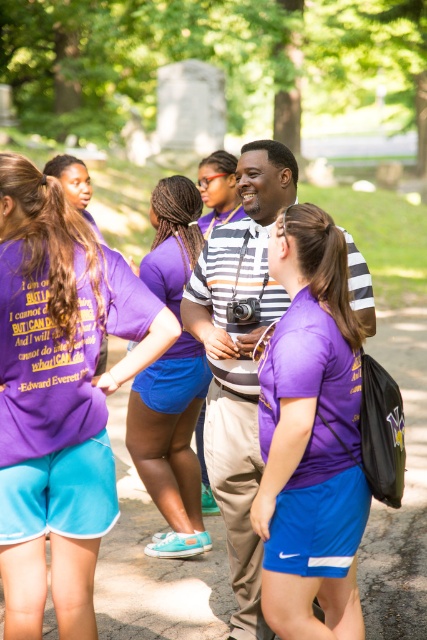
Question: Among these points, which one is farthest from the camera?

Choices:
 (A) (101, 240)
 (B) (161, 269)
 (C) (228, 316)

Answer: (B)

Question: Is striped fabric camera at center positioned before purple cotton shirt at center?

Choices:
 (A) no
 (B) yes

Answer: (B)

Question: Considering the real-world distances, which object is farthest from the purple cotton shirt at center?

Choices:
 (A) purple fabric shorts at center
 (B) matte purple shirt at center

Answer: (A)

Question: Can you confirm if purple fabric shorts at center is positioned to the right of purple cotton shirt at center?

Choices:
 (A) yes
 (B) no

Answer: (A)

Question: Can you confirm if striped fabric camera at center is positioned to the right of matte purple shirt at center?

Choices:
 (A) no
 (B) yes

Answer: (B)

Question: Which point is closer to the camera?

Choices:
 (A) (172, 333)
 (B) (219, 214)
 (C) (49, 161)
 (D) (193, 496)

Answer: (A)